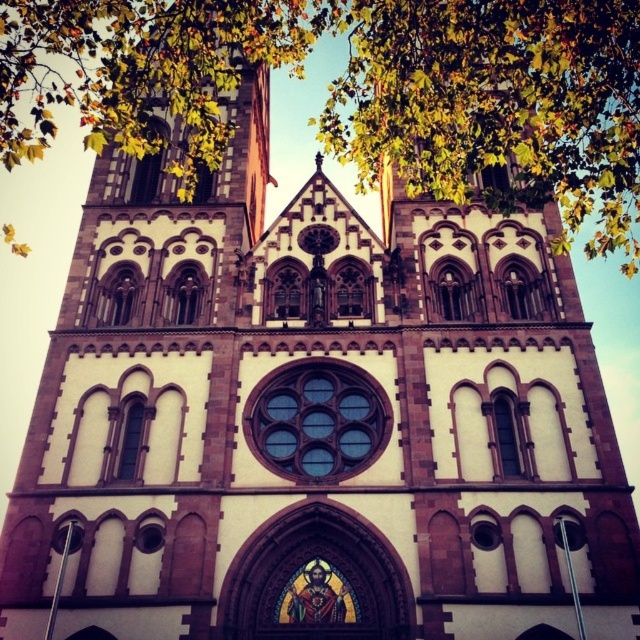
What do you see at coordinates (356, 90) in the screenshot?
I see `green leafy tree at upper center` at bounding box center [356, 90].

This screenshot has height=640, width=640. What do you see at coordinates (356, 90) in the screenshot? I see `green leafy tree at upper center` at bounding box center [356, 90].

The width and height of the screenshot is (640, 640). Find the location of `green leafy tree at upper center`. green leafy tree at upper center is located at coordinates (356, 90).